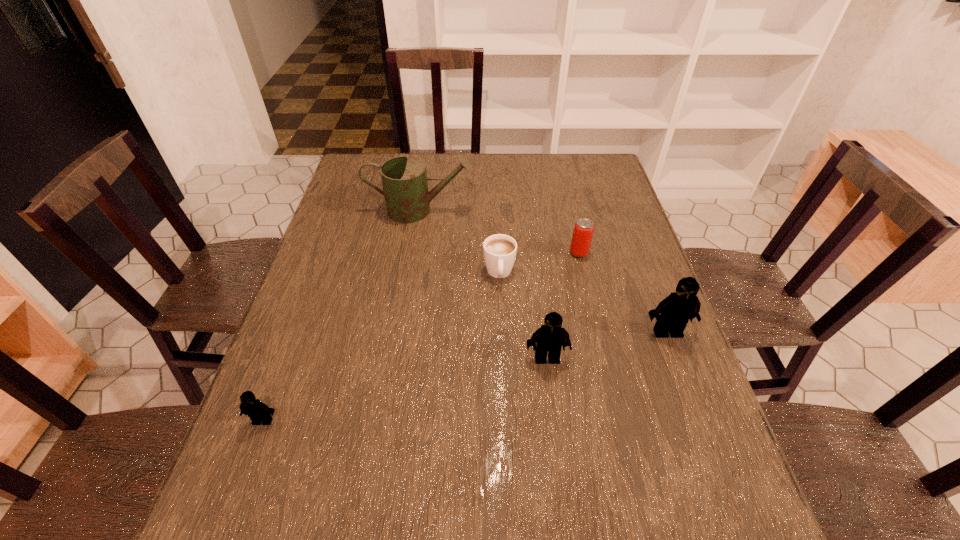
Image resolution: width=960 pixels, height=540 pixels. In order to click on the leftmost Lego in this screenshot , I will do `click(258, 412)`.

In order to click on the leftmost object in this screenshot , I will do `click(258, 412)`.

Locate an element on the screen. Image resolution: width=960 pixels, height=540 pixels. the second nearest object is located at coordinates (551, 337).

Where is `the second tallest Lego`? This screenshot has width=960, height=540. the second tallest Lego is located at coordinates (551, 337).

Where is `the fourth farthest object`? The height and width of the screenshot is (540, 960). the fourth farthest object is located at coordinates (672, 314).

I want to click on the farthest Lego, so click(x=672, y=314).

Where is `the fifth object from right to left`? the fifth object from right to left is located at coordinates (404, 179).

I want to click on watering can, so point(404,179).

Locate an element on the screen. the second object from right to left is located at coordinates (583, 230).

Find the location of `the third object from left to right`. the third object from left to right is located at coordinates (499, 250).